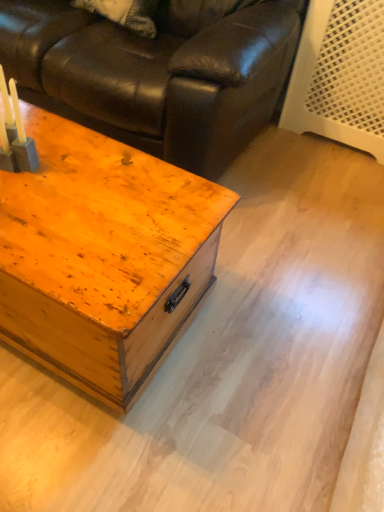
Question: Can you confirm if wooden trunk at center is smaller than matte gray candle holder at left?

Choices:
 (A) no
 (B) yes

Answer: (A)

Question: From a real-world perspective, is wooden trunk at center below matte gray candle holder at left?

Choices:
 (A) yes
 (B) no

Answer: (A)

Question: From a real-world perspective, is wooden trunk at center on top of matte gray candle holder at left?

Choices:
 (A) yes
 (B) no

Answer: (B)

Question: Is wooden trunk at center at the left side of matte gray candle holder at left?

Choices:
 (A) yes
 (B) no

Answer: (A)

Question: Is wooden trunk at center positioned beyond the bounds of matte gray candle holder at left?

Choices:
 (A) no
 (B) yes

Answer: (B)

Question: Is wooden trunk at center further to the viewer compared to matte gray candle holder at left?

Choices:
 (A) yes
 (B) no

Answer: (B)

Question: Is matte black leather couch at upper left surrounded by wooden trunk at center?

Choices:
 (A) yes
 (B) no

Answer: (B)

Question: Would you say wooden trunk at center is outside matte black leather couch at upper left?

Choices:
 (A) yes
 (B) no

Answer: (A)

Question: Does wooden trunk at center lie behind matte black leather couch at upper left?

Choices:
 (A) yes
 (B) no

Answer: (B)

Question: Can you confirm if wooden trunk at center is thinner than matte black leather couch at upper left?

Choices:
 (A) no
 (B) yes

Answer: (B)

Question: Is wooden trunk at center directly adjacent to matte black leather couch at upper left?

Choices:
 (A) no
 (B) yes

Answer: (A)

Question: Is wooden trunk at center at the left side of matte black leather couch at upper left?

Choices:
 (A) no
 (B) yes

Answer: (B)

Question: Is matte black leather couch at upper left closer to camera compared to matte gray candle holder at left?

Choices:
 (A) yes
 (B) no

Answer: (B)